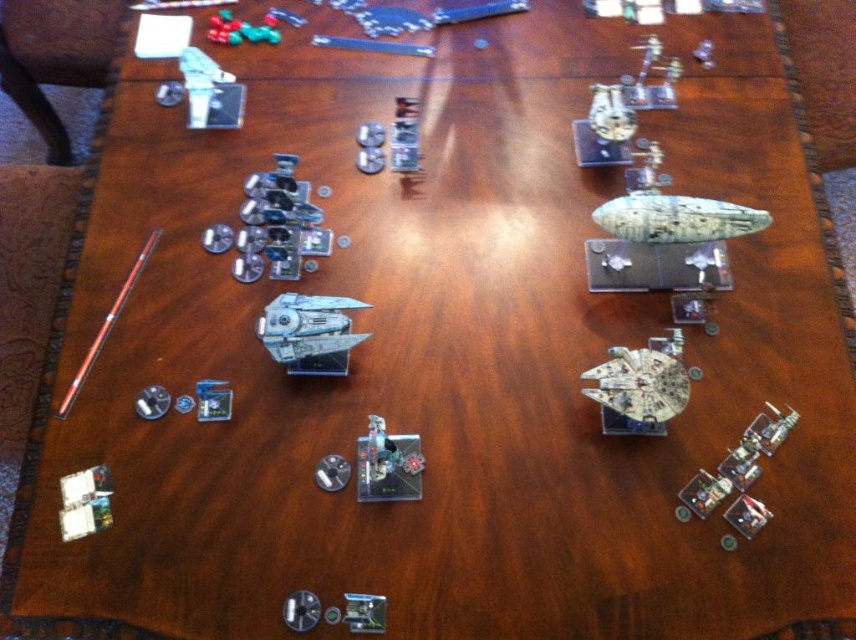
You are a player in a tabletop game and want to place your model ship on a specific spot marked by point coordinates. The table is 4 feet wide. Can you reach the point at coordinates point (x=64, y=483) from the edge of the table?

The point (x=64, y=483) is 3.81 feet away from the camera, so if the table is 4 feet wide, you can reach it since it is within the table dimensions.

You are a player standing at the edge of the table where the shiny plastic dice at upper left are located. You want to reach for the dice but need to know if they are within arm s length. Assuming your arm can reach up to 1 meter, can you grab them?

The shiny plastic dice at upper left are 1.46 meters away from the viewer, which is beyond the 1 meter reach of your arm. Therefore, you cannot grab them.